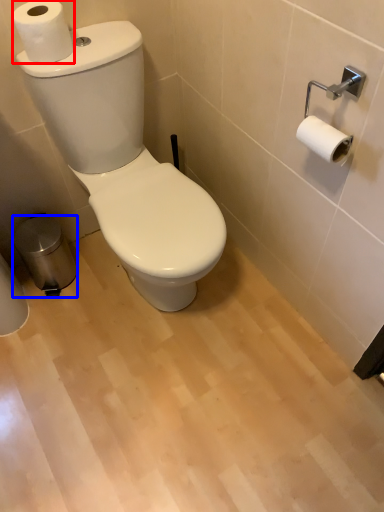
Question: Which object appears farthest to the camera in this image, toilet paper (highlighted by a red box) or trash bin/can (highlighted by a blue box)?

Choices:
 (A) toilet paper
 (B) trash bin/can

Answer: (B)